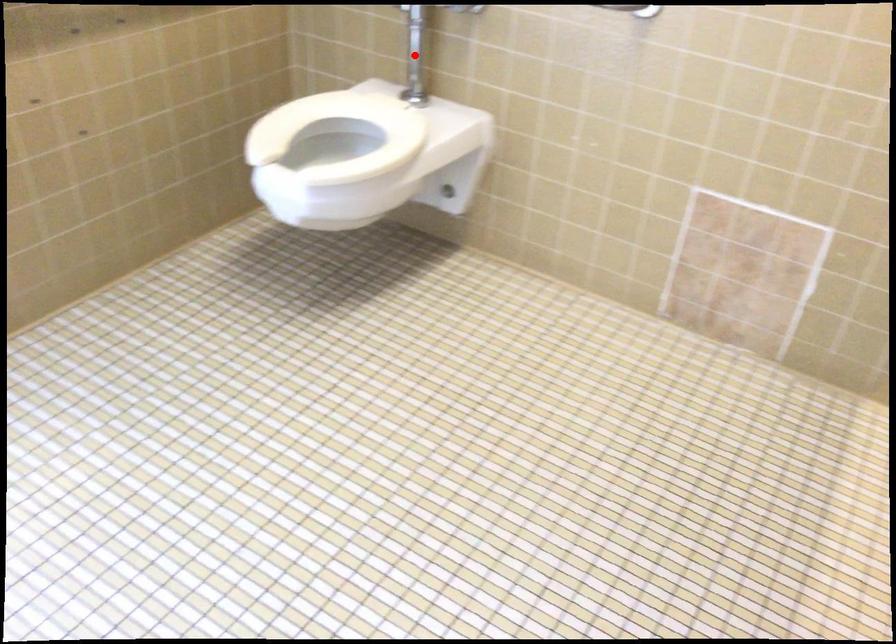
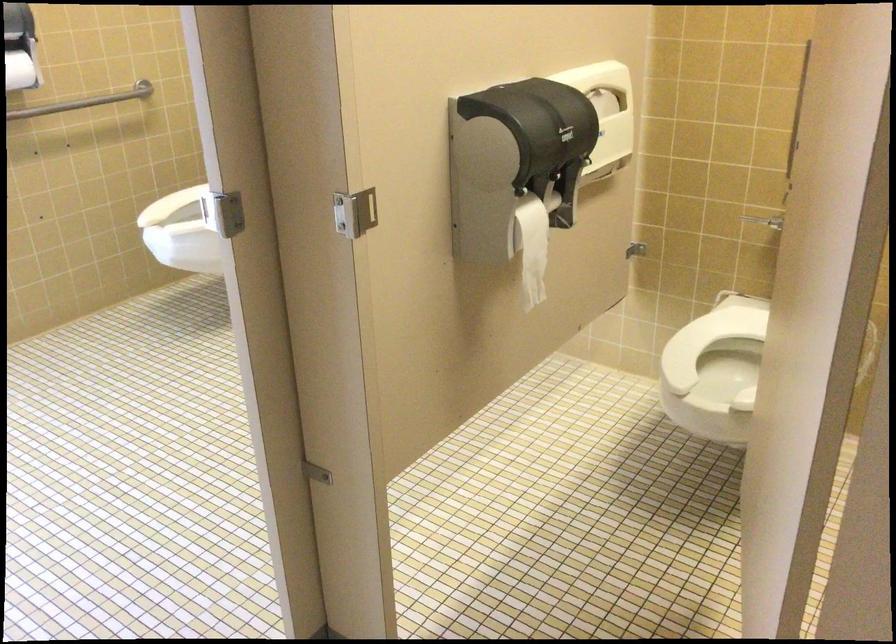
Question: I am providing you with two images of the same scene from different viewpoints. A red point is marked on the first image. At the location where the point appears in image 1, is it still visible in image 2?

Choices:
 (A) Yes
 (B) No

Answer: (B)